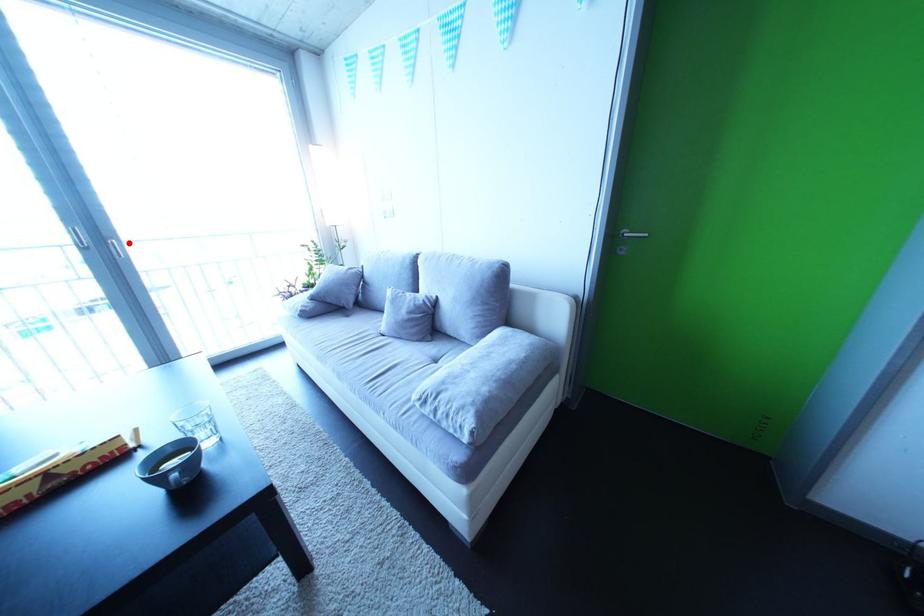
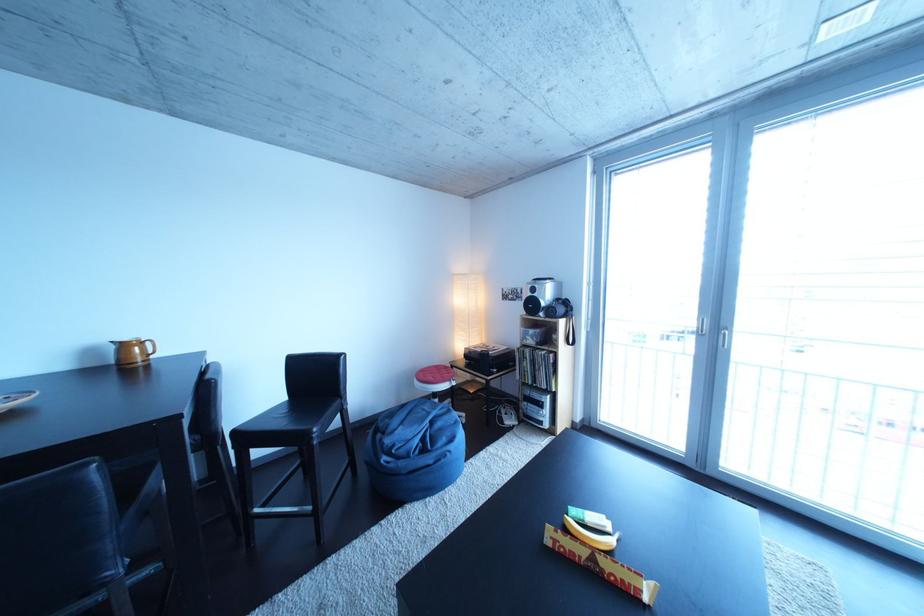
The point at the highlighted location is marked in the first image. Where is the corresponding point in the second image?

(743, 334)